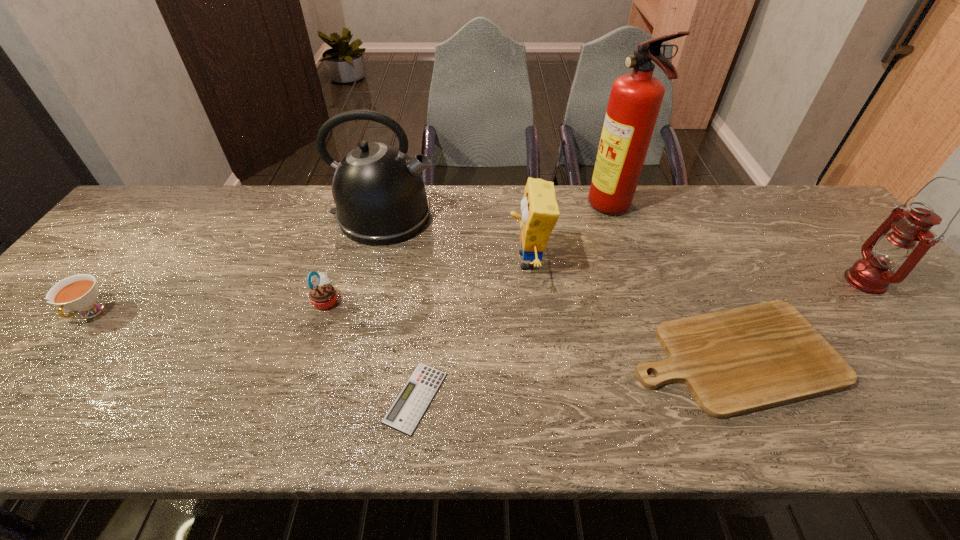
You are a GUI agent. You are given a task and a screenshot of the screen. Output one action in this format:
    pyautogui.click(x=<x>, y=<y>)
    Task: Click on the free space at the near edge of the desktop
    This screenshot has height=540, width=960.
    Given the screenshot: What is the action you would take?
    pyautogui.click(x=123, y=420)

The height and width of the screenshot is (540, 960). What are the coordinates of `free space at the left edge` in the screenshot? It's located at (10, 383).

Where is `vacant space at the right edge of the desktop`? The image size is (960, 540). vacant space at the right edge of the desktop is located at coordinates (905, 352).

The image size is (960, 540). In order to click on vacant area at the far right corner of the desktop in this screenshot , I will do `click(782, 215)`.

Where is `vacant space that's between the tallest object and the fourth tallest object`? Image resolution: width=960 pixels, height=540 pixels. vacant space that's between the tallest object and the fourth tallest object is located at coordinates (569, 234).

Where is `free space between the tallest object and the fourth tallest object`? Image resolution: width=960 pixels, height=540 pixels. free space between the tallest object and the fourth tallest object is located at coordinates (569, 234).

At what (x,y) coordinates should I click in order to perform the action: click on vacant area that lies between the fifth tallest object and the rightmost object. Please return your answer as a coordinate pair (x, y). The height and width of the screenshot is (540, 960). Looking at the image, I should click on (595, 291).

This screenshot has height=540, width=960. Identify the location of empty space between the oil lamp and the kettle. (624, 248).

The width and height of the screenshot is (960, 540). What are the coordinates of `vacant space that's between the fire extinguisher and the rightmost object` in the screenshot? It's located at (738, 245).

Where is `unoccupied area between the fourth object from right to left and the rightmost object`? unoccupied area between the fourth object from right to left and the rightmost object is located at coordinates (696, 271).